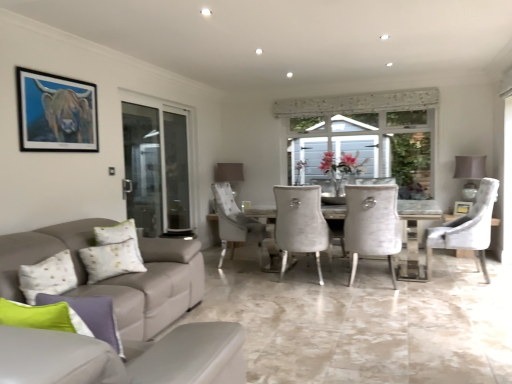
In order to click on empty space that is ontop of transparent glass screen door at left in this screenshot , I will do `click(160, 100)`.